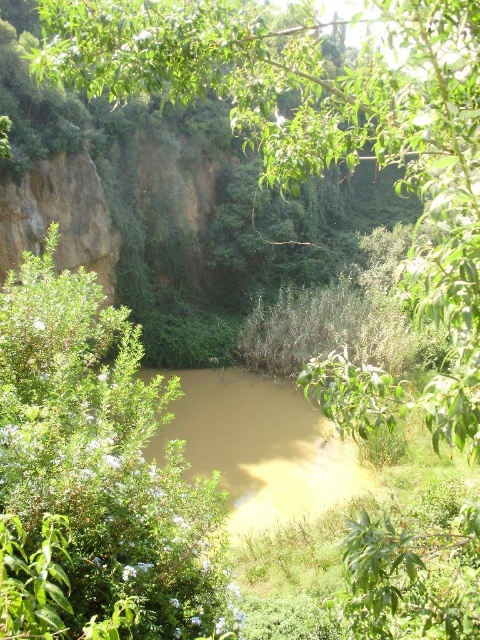
Does point (476, 173) come closer to viewer compared to point (289, 410)?

Yes.

Is green leafy tree at center wider than brown muddy water at center?

Indeed, green leafy tree at center has a greater width compared to brown muddy water at center.

Locate an element on the screen. This screenshot has height=640, width=480. green leafy tree at center is located at coordinates (324, 141).